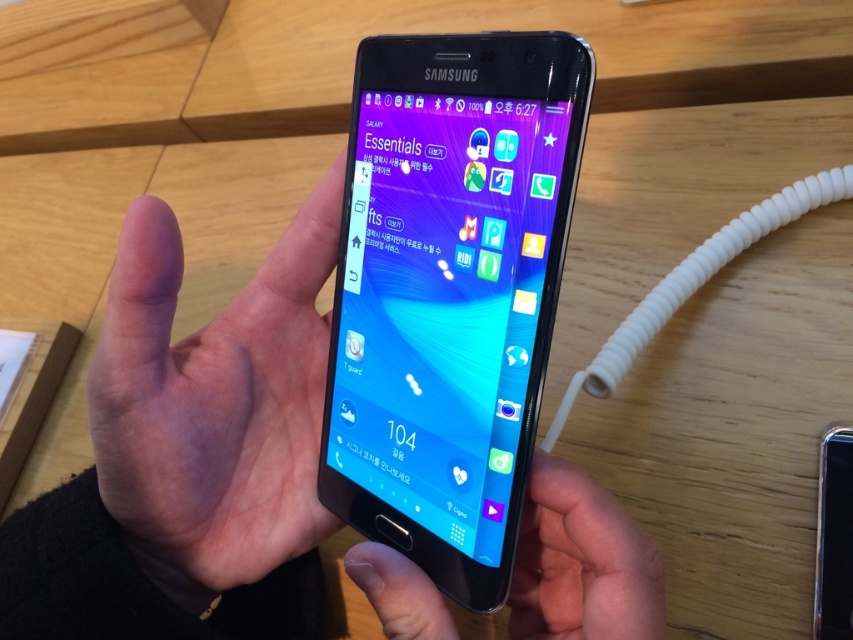
Question: Which object is farther from the camera taking this photo?

Choices:
 (A) pink flesh at center
 (B) satin black phone at center
 (C) black matte phone at center
 (D) matte black phone at center

Answer: (A)

Question: Can you confirm if satin black phone at center is bigger than metallic silver phone at center?

Choices:
 (A) no
 (B) yes

Answer: (B)

Question: Can you confirm if black matte phone at center is positioned below metallic silver phone at center?

Choices:
 (A) no
 (B) yes

Answer: (A)

Question: Which point is farther to the camera?

Choices:
 (A) satin black phone at center
 (B) matte black phone at center
 (C) black matte phone at center
 (D) metallic silver phone at center

Answer: (D)

Question: Which is farther from the black matte phone at center?

Choices:
 (A) metallic silver phone at center
 (B) pink flesh at center
 (C) matte black phone at center
 (D) satin black phone at center

Answer: (A)

Question: Does black matte phone at center come in front of metallic silver phone at center?

Choices:
 (A) yes
 (B) no

Answer: (A)